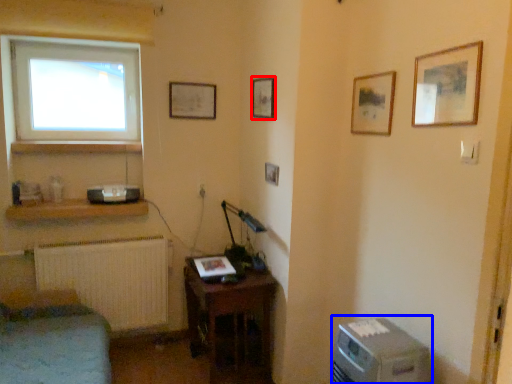
Question: Which object appears closest to the camera in this image, picture frame (highlighted by a red box) or desktop computer (highlighted by a blue box)?

Choices:
 (A) picture frame
 (B) desktop computer

Answer: (B)